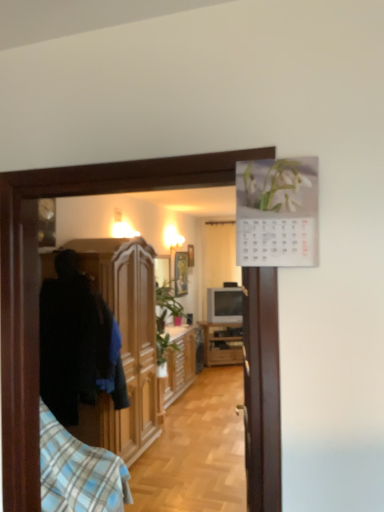
In order to face wooden cabinet at center, the third cabinetry viewed from the front, should I rotate leftwards or rightwards?

A 4.063 degree turn to the right will do.

Identify the location of wooden picture frame at center. This screenshot has height=512, width=384. (181, 273).

Locate an element on the screen. The image size is (384, 512). white sheer curtain at center is located at coordinates (218, 257).

How different are the orientations of matte gray television at center and white sheer curtain at center in degrees?

25 degrees separate the facing orientations of matte gray television at center and white sheer curtain at center.

Is matte gray television at center smaller than white sheer curtain at center?

Indeed, matte gray television at center has a smaller size compared to white sheer curtain at center.

From the image's perspective, is matte gray television at center beneath white sheer curtain at center?

Yes, from the image's perspective, matte gray television at center is beneath white sheer curtain at center.

Is matte gray television at center at the right side of white sheer curtain at center?

No, matte gray television at center is not to the right of white sheer curtain at center.

Locate an element on the screen. television lying behind the wooden cabinet at center, acting as the 1th cabinetry starting from the back is located at coordinates (224, 305).

Does wooden cabinet at center, the third cabinetry viewed from the front, lie behind matte gray television at center?

No, wooden cabinet at center, the third cabinetry viewed from the front, is closer to the camera.

From a real-world perspective, is wooden cabinet at center, the third cabinetry viewed from the front, over matte gray television at center?

No, from a real-world perspective, wooden cabinet at center, the third cabinetry viewed from the front, is not on top of matte gray television at center.

Which is correct: wooden cabinet at center, acting as the 1th cabinetry starting from the back, is inside matte gray television at center, or outside of it?

wooden cabinet at center, acting as the 1th cabinetry starting from the back, lies outside matte gray television at center.

Which is behind, point (212, 226) or point (224, 294)?

The point (212, 226) is farther.

Where is `curtain above the matte gray television at center (from the image's perspective)`? The width and height of the screenshot is (384, 512). curtain above the matte gray television at center (from the image's perspective) is located at coordinates (218, 257).

Based on the photo, does white sheer curtain at center have a lesser height compared to matte gray television at center?

No, white sheer curtain at center is not shorter than matte gray television at center.

Which of these two, white sheer curtain at center or matte gray television at center, is bigger?

Bigger between the two is white sheer curtain at center.

Considering the relative positions of blue plaid shirt at left and wooden cabinet at left, which is counted as the first cabinetry, starting from the front, in the image provided, is blue plaid shirt at left behind wooden cabinet at left, which is counted as the first cabinetry, starting from the front,?

That is False.

Identify the location of bedding below the wooden cabinet at left, the third cabinetry in the back-to-front sequence (from the image's perspective). Image resolution: width=384 pixels, height=512 pixels. (78, 472).

Could you tell me if blue plaid shirt at left is turned towards wooden cabinet at left, the third cabinetry in the back-to-front sequence?

No, blue plaid shirt at left is not turned towards wooden cabinet at left, the third cabinetry in the back-to-front sequence.

Locate an element on the screen. This screenshot has height=512, width=384. picture frame above the wooden cabinet at left, which is counted as the first cabinetry, starting from the front (from a real-world perspective) is located at coordinates (181, 273).

Considering the sizes of objects wooden cabinet at left, which is counted as the first cabinetry, starting from the front, and wooden picture frame at center in the image provided, who is smaller, wooden cabinet at left, which is counted as the first cabinetry, starting from the front, or wooden picture frame at center?

With smaller size is wooden picture frame at center.

From a real-world perspective, is wooden cabinet at left, the third cabinetry in the back-to-front sequence, on wooden picture frame at center?

No, from a real-world perspective, wooden cabinet at left, the third cabinetry in the back-to-front sequence, is not over wooden picture frame at center

Is wooden cabinet at left, which is counted as the first cabinetry, starting from the front, turned away from wooden picture frame at center?

wooden cabinet at left, which is counted as the first cabinetry, starting from the front, does not have its back to wooden picture frame at center.

From a real-world perspective, is wooden picture frame at center positioned under wooden cabinet at left, which is counted as the first cabinetry, starting from the front, based on gravity?

No, from a real-world perspective, wooden picture frame at center is not under wooden cabinet at left, which is counted as the first cabinetry, starting from the front.

Does point (175, 270) come behind point (121, 429)?

Yes, point (175, 270) is farther from viewer.

Could you tell me if wooden picture frame at center is facing wooden cabinet at left, which is counted as the first cabinetry, starting from the front?

No.

Is wooden picture frame at center directly adjacent to white sheer curtain at center?

No, wooden picture frame at center is not with white sheer curtain at center.

Between wooden picture frame at center and white sheer curtain at center, which one appears on the right side from the viewer's perspective?

white sheer curtain at center is more to the right.

Which of these two, wooden picture frame at center or white sheer curtain at center, is smaller?

Smaller between the two is wooden picture frame at center.

This screenshot has width=384, height=512. What are the coordinates of `curtain on the right of matte gray television at center` in the screenshot? It's located at (218, 257).

Identify the location of television behind the wooden cabinet at center, acting as the 1th cabinetry starting from the back. (224, 305).

Estimate the real-world distances between objects in this image. Which object is further from white sheer curtain at center, matte gray television at center or wooden cabinet at left, which is counted as the first cabinetry, starting from the front?

Based on the image, wooden cabinet at left, which is counted as the first cabinetry, starting from the front, appears to be further to white sheer curtain at center.

Which object lies further to the anchor point wooden cabinet at left, the third cabinetry in the back-to-front sequence, wooden cabinet at center, the third cabinetry viewed from the front, or wooden picture frame at center?

wooden cabinet at center, the third cabinetry viewed from the front, is further to wooden cabinet at left, the third cabinetry in the back-to-front sequence.

Estimate the real-world distances between objects in this image. Which object is closer to white sheer curtain at center, matte gray television at center or wooden picture frame at center?

matte gray television at center.

From the image, which object appears to be farther from matte gray television at center, wooden cabinet at center, the third cabinetry viewed from the front, or wooden cabinet at center, the 2th cabinetry in the front-to-back sequence?

Among the two, wooden cabinet at center, the 2th cabinetry in the front-to-back sequence, is located further to matte gray television at center.

When comparing their distances from wooden cabinet at center, the 2th cabinetry in the front-to-back sequence, does matte gray television at center or wooden picture frame at center seem closer?

The object closer to wooden cabinet at center, the 2th cabinetry in the front-to-back sequence, is wooden picture frame at center.

Considering their positions, is wooden picture frame at center positioned further to wooden cabinet at center, the third cabinetry viewed from the front, than white sheer curtain at center?

wooden picture frame at center is positioned further to the anchor wooden cabinet at center, the third cabinetry viewed from the front.

Estimate the real-world distances between objects in this image. Which object is closer to matte gray television at center, wooden cabinet at center, acting as the 1th cabinetry starting from the back, or blue plaid shirt at left?

wooden cabinet at center, acting as the 1th cabinetry starting from the back, lies closer to matte gray television at center than the other object.

Based on their spatial positions, is blue plaid shirt at left or matte gray television at center further from wooden picture frame at center?

blue plaid shirt at left.

Where is `television between wooden picture frame at center and white sheer curtain at center from front to back`? This screenshot has width=384, height=512. television between wooden picture frame at center and white sheer curtain at center from front to back is located at coordinates (224, 305).

Where is `picture frame between blue plaid shirt at left and wooden cabinet at center, the third cabinetry viewed from the front, in the front-back direction`? The width and height of the screenshot is (384, 512). picture frame between blue plaid shirt at left and wooden cabinet at center, the third cabinetry viewed from the front, in the front-back direction is located at coordinates (181, 273).

Locate an element on the screen. The image size is (384, 512). cabinetry located between wooden cabinet at left, the third cabinetry in the back-to-front sequence, and wooden picture frame at center in the depth direction is located at coordinates (178, 365).

I want to click on cabinetry between wooden cabinet at left, the third cabinetry in the back-to-front sequence, and wooden cabinet at center, the third cabinetry viewed from the front, in the front-back direction, so click(178, 365).